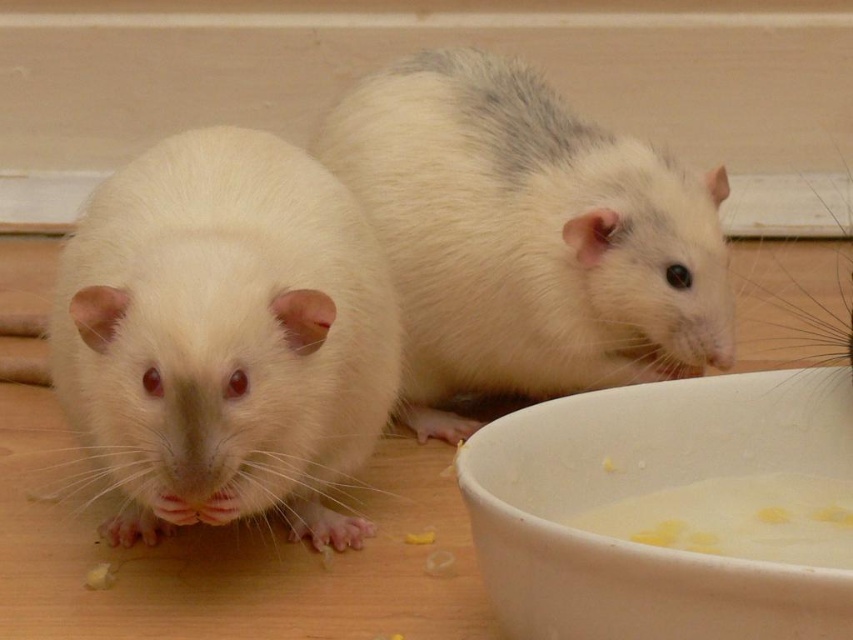
Describe the element at coordinates (224, 336) in the screenshot. Image resolution: width=853 pixels, height=640 pixels. I see `white fur hamster at left` at that location.

Does point (343, 186) come farther from viewer compared to point (509, 580)?

That is True.

Who is more forward, (144, 224) or (674, 384)?

Point (144, 224) is in front.

Identify the location of white fur hamster at left. This screenshot has width=853, height=640. (224, 336).

From the picture: Is white matte bowl at lower right further to the viewer compared to white creamy food at lower center?

No, white matte bowl at lower right is in front of white creamy food at lower center.

Measure the distance between point (811, 458) and camera.

Point (811, 458) is 3.80 feet from camera.

You are a GUI agent. You are given a task and a screenshot of the screen. Output one action in this format:
    pyautogui.click(x=<x>, y=<y>)
    Task: Click on the white matte bowl at lower right
    Image resolution: width=853 pixels, height=640 pixels.
    Given the screenshot: What is the action you would take?
    pyautogui.click(x=639, y=490)

Is white fluffy hamster at upper right shorter than white creamy food at lower center?

No.

In the scene shown: Does white fluffy hamster at upper right come in front of white creamy food at lower center?

No, it is not.

Is point (392, 227) positioned before point (757, 554)?

That is False.

Locate an element on the screen. white fluffy hamster at upper right is located at coordinates (527, 237).